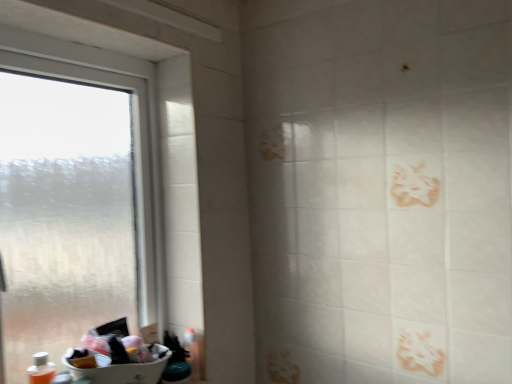
Image resolution: width=512 pixels, height=384 pixels. Describe the element at coordinates (68, 204) in the screenshot. I see `transparent frosted glass window at left` at that location.

At what (x,y) coordinates should I click in order to perform the action: click on transparent frosted glass window at left. Please return your answer as a coordinate pair (x, y). This screenshot has height=384, width=512. Looking at the image, I should click on (68, 204).

Image resolution: width=512 pixels, height=384 pixels. I want to click on translucent plastic bottle at lower left, so click(41, 369).

Is translucent plastic bottle at lower left far away from white plastic sink at lower left?

They are positioned close to each other.

From the picture: From a real-world perspective, which object rests below the other?

translucent plastic bottle at lower left is physically lower.

Can you confirm if translucent plastic bottle at lower left is wider than white plastic sink at lower left?

No, translucent plastic bottle at lower left is not wider than white plastic sink at lower left.

Based on the photo, would you say translucent plastic bottle at lower left is inside or outside white plastic sink at lower left?

translucent plastic bottle at lower left cannot be found inside white plastic sink at lower left.

Which of these two, transparent frosted glass window at left or white plastic sink at lower left, stands taller?

With more height is transparent frosted glass window at left.

Considering the relative sizes of transparent frosted glass window at left and white plastic sink at lower left in the image provided, is transparent frosted glass window at left wider than white plastic sink at lower left?

In fact, transparent frosted glass window at left might be narrower than white plastic sink at lower left.

Would you say white plastic sink at lower left is part of transparent frosted glass window at left's contents?

Absolutely, white plastic sink at lower left is inside transparent frosted glass window at left.

Is white plastic sink at lower left facing towards translucent plastic bottle at lower left?

No.

From a real-world perspective, is white plastic sink at lower left physically above translucent plastic bottle at lower left?

Indeed, from a real-world perspective, white plastic sink at lower left stands above translucent plastic bottle at lower left.

Between white plastic sink at lower left and translucent plastic bottle at lower left, which one is positioned in front?

white plastic sink at lower left is in front.

Locate an element on the screen. The image size is (512, 384). toiletry on the left of the white plastic sink at lower left is located at coordinates pyautogui.click(x=41, y=369).

From a real-world perspective, does transparent frosted glass window at left sit lower than translucent plastic bottle at lower left?

No, from a real-world perspective, transparent frosted glass window at left is not under translucent plastic bottle at lower left.

Between transparent frosted glass window at left and translucent plastic bottle at lower left, which one has larger width?

With larger width is transparent frosted glass window at left.

What's the angular difference between transparent frosted glass window at left and translucent plastic bottle at lower left's facing directions?

0.0126 degrees separate the facing orientations of transparent frosted glass window at left and translucent plastic bottle at lower left.

Which is more to the left, translucent plastic bottle at lower left or transparent frosted glass window at left?

translucent plastic bottle at lower left.

Which object is thinner, translucent plastic bottle at lower left or transparent frosted glass window at left?

translucent plastic bottle at lower left.

Who is bigger, translucent plastic bottle at lower left or transparent frosted glass window at left?

With larger size is transparent frosted glass window at left.

Considering the points (144, 383) and (99, 311), which point is behind, point (144, 383) or point (99, 311)?

The point (99, 311) is more distant.

Locate an element on the screen. This screenshot has height=384, width=512. window above the white plastic sink at lower left (from the image's perspective) is located at coordinates (68, 204).

Considering the sizes of objects white plastic sink at lower left and transparent frosted glass window at left in the image provided, who is shorter, white plastic sink at lower left or transparent frosted glass window at left?

Standing shorter between the two is white plastic sink at lower left.

Find the location of a particular element. Image resolution: width=512 pixels, height=384 pixels. toiletry below the white plastic sink at lower left (from a real-world perspective) is located at coordinates (41, 369).

Locate an element on the screen. The width and height of the screenshot is (512, 384). window located in front of the white plastic sink at lower left is located at coordinates (68, 204).

Looking at the image, which one is located closer to white plastic sink at lower left, translucent plastic bottle at lower left or transparent frosted glass window at left?

translucent plastic bottle at lower left is closer to white plastic sink at lower left.

Considering their positions, is translucent plastic bottle at lower left positioned closer to transparent frosted glass window at left than white plastic sink at lower left?

Based on the image, white plastic sink at lower left appears to be nearer to transparent frosted glass window at left.

Which object lies further to the anchor point translucent plastic bottle at lower left, white plastic sink at lower left or transparent frosted glass window at left?

transparent frosted glass window at left is further to translucent plastic bottle at lower left.

From the picture: Estimate the real-world distances between objects in this image. Which object is further from transparent frosted glass window at left, white plastic sink at lower left or translucent plastic bottle at lower left?

Based on the image, translucent plastic bottle at lower left appears to be further to transparent frosted glass window at left.

From the image, which object appears to be farther from translucent plastic bottle at lower left, transparent frosted glass window at left or white plastic sink at lower left?

The object further to translucent plastic bottle at lower left is transparent frosted glass window at left.

When comparing their distances from white plastic sink at lower left, does transparent frosted glass window at left or translucent plastic bottle at lower left seem closer?

translucent plastic bottle at lower left is positioned closer to the anchor white plastic sink at lower left.

Identify the location of sink that lies between transparent frosted glass window at left and translucent plastic bottle at lower left from top to bottom. Image resolution: width=512 pixels, height=384 pixels. (119, 357).